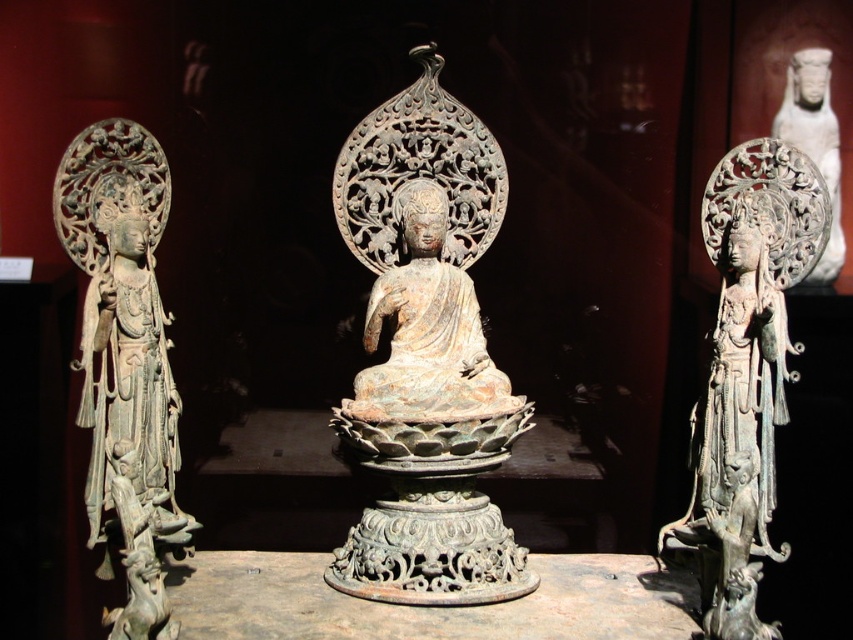
You are a museum visitor standing in front of the exhibit. You want to take a photo of both the bronze statue at center and the white porcelain statue at upper right. Which statue should you focus on first to ensure both are in frame?

The bronze statue at center is below the white porcelain statue at upper right, so you should focus on the bronze statue at center first to ensure both are in frame.

You are standing in the museum and want to take a photo of the rusty bronze statue at center. The camera requires you to stand exactly at the point with coordinates [426,355] to capture the statue perfectly. Can you confirm if the statue is located at that point?

The rusty bronze statue at center is represented by point [426,355], so yes, standing at that point will allow you to capture the statue perfectly.

You are a visitor in the museum and want to take a photo of the bronze statue at center. The museum allows photos but requires you to stand at a specific point marked by coordinates. The point given is point (x=746, y=372). Is this point the correct location to capture the bronze statue at center in your photo?

Yes, the point (x=746, y=372) marks the bronze statue at center, so standing there will allow you to capture it in your photo.